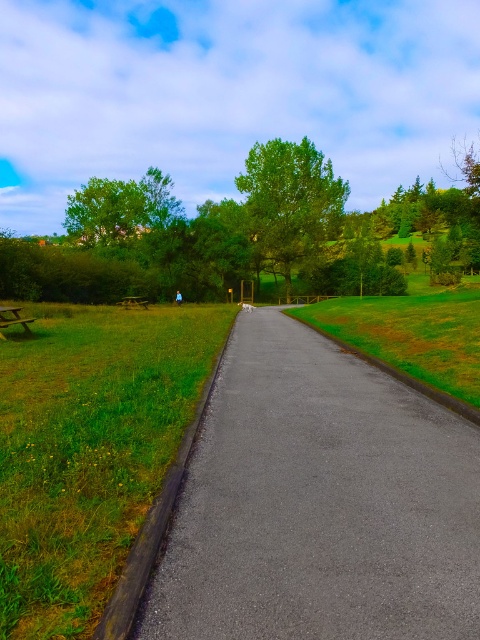
You are standing at the starting point of the path and want to walk to the picnic table on the left side. According to the image, where is the asphalt at center located in relation to your current position?

The asphalt at center is located at point (320, 502) in the image, so it is positioned to the right and slightly forward from your current starting position on the path.

You are a gardener planning to mow the green grass at center and the wooden picnic table at center. Which area should you mow first if you want to start from the closest point to your current position?

The green grass at center is in front of the wooden picnic table at center, so you should mow the green grass at center first as it is closer to your current position.

You are a gardener planning to plant a row of flowers along the center of the path. Given the asphalt at center and green grass at center, which material has a narrower width to accommodate the flowers?

The asphalt at center is thinner than green grass at center, so the asphalt at center has a narrower width and would be better for planting flowers along the center of the path.